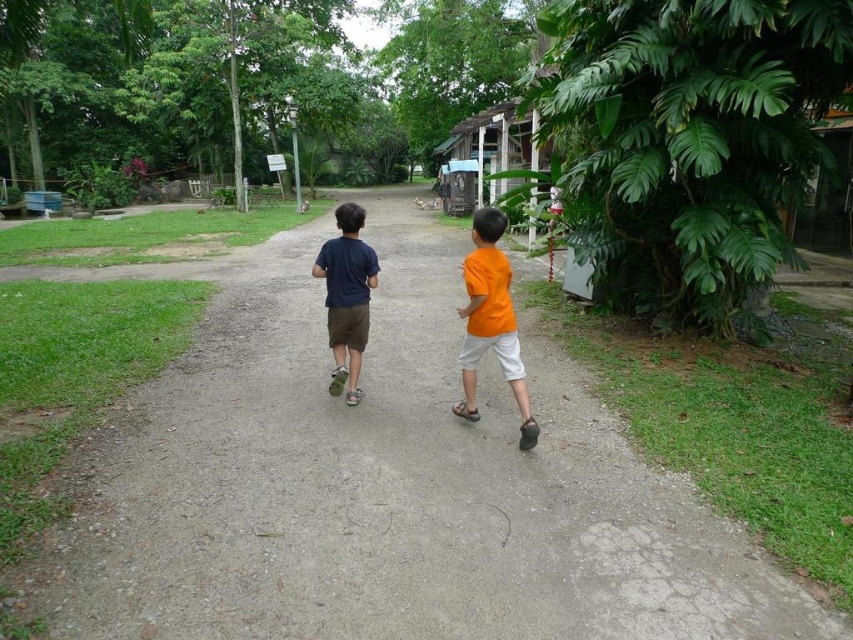
You are standing at the point labeled point (653,572) and want to walk to the point labeled point (350,237). Which direction should you face to walk towards your destination?

You should face away from the viewer because point (653,572) is closer to the viewer than point (350,237).

You are a photographer trying to capture the two children walking on the path. You notice the orange matte shirt at center and the matte blue shirt at center. Which child should you focus on first if you want to photograph the one closer to the camera?

The orange matte shirt at center is above the matte blue shirt at center, indicating it is closer to the camera. Focus on the orange matte shirt at center first.